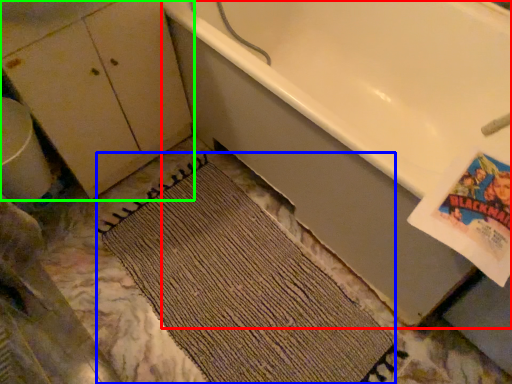
Question: Which object is the closest to the bathtub (highlighted by a red box)? Choose among these: doormat (highlighted by a blue box) or dresser (highlighted by a green box).

Choices:
 (A) doormat
 (B) dresser

Answer: (A)